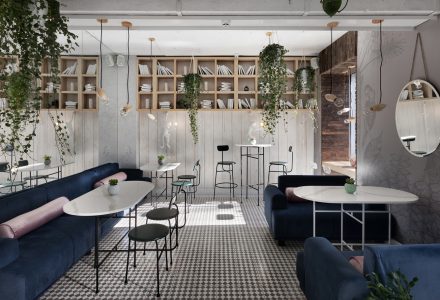
Where is `hanging plants`? The height and width of the screenshot is (300, 440). hanging plants is located at coordinates (17, 47), (186, 79), (258, 64), (301, 75).